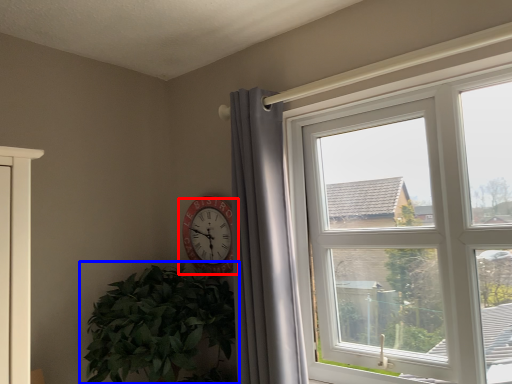
Question: Which point is further to the camera, wall clock (highlighted by a red box) or houseplant (highlighted by a blue box)?

Choices:
 (A) wall clock
 (B) houseplant

Answer: (A)